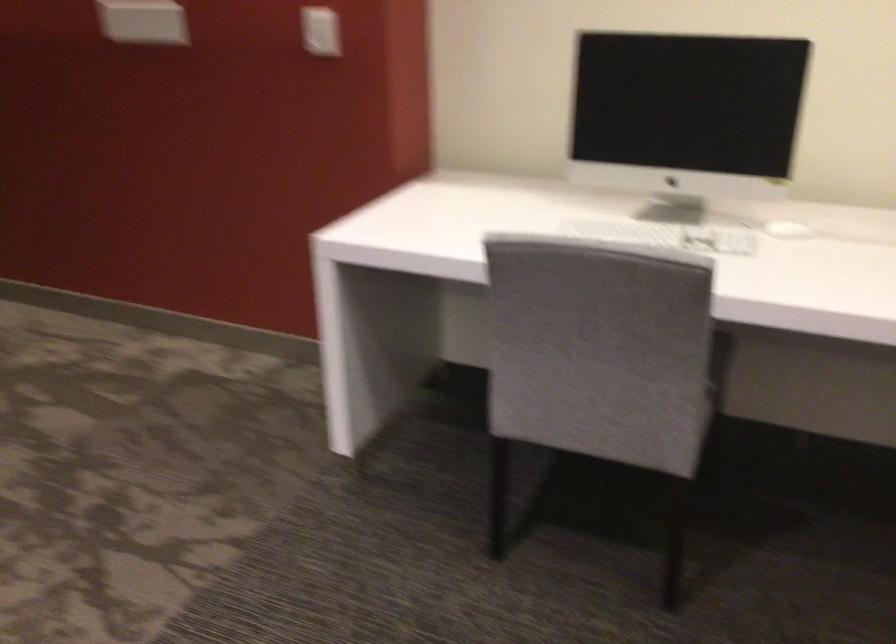
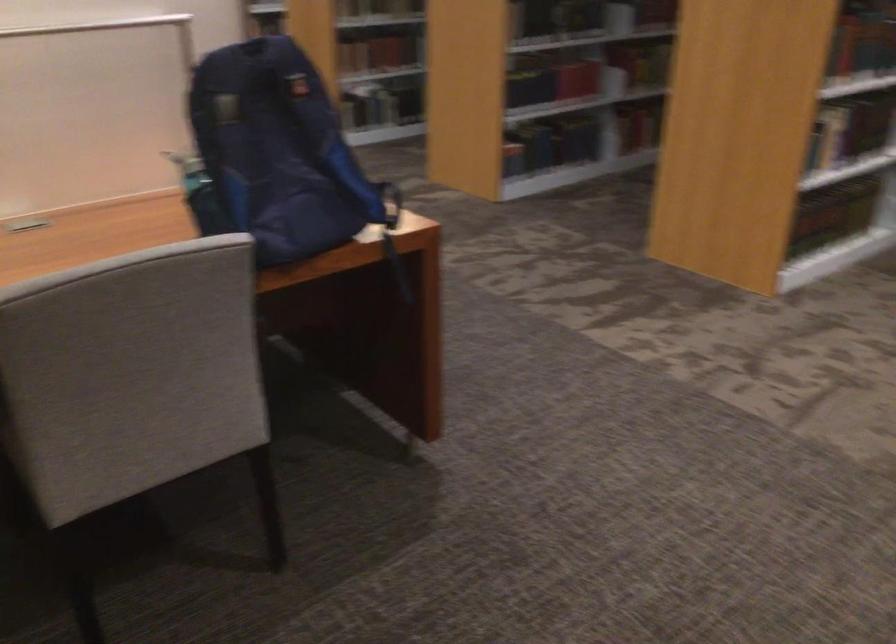
First-person continuous shooting, in which direction is the camera rotating?

The camera rotated toward left-down.